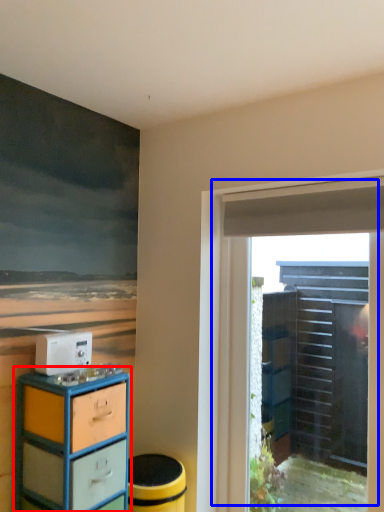
Question: Which point is further to the camera, chest of drawers (highlighted by a red box) or door (highlighted by a blue box)?

Choices:
 (A) chest of drawers
 (B) door

Answer: (B)